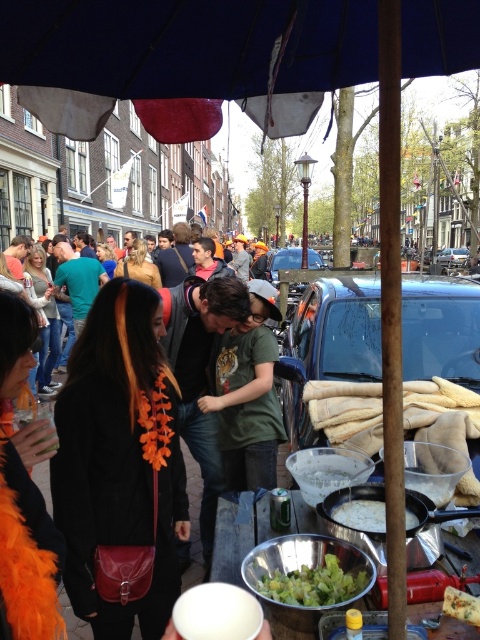
Between point (288, 596) and point (284, 259), which one is positioned in front?

Positioned in front is point (288, 596).

Can you confirm if green leafy salad at lower center is positioned to the left of metallic blue car at center?

Correct, you'll find green leafy salad at lower center to the left of metallic blue car at center.

Which is in front, point (349, 588) or point (276, 250)?

Point (349, 588) is in front.

You are a GUI agent. You are given a task and a screenshot of the screen. Output one action in this format:
    pyautogui.click(x=<x>, y=<y>)
    Task: Click on the green leafy salad at lower center
    The width and height of the screenshot is (480, 640).
    Given the screenshot: What is the action you would take?
    pyautogui.click(x=313, y=584)

Which is more to the right, white creamy soup at center or metallic blue car at center?

From the viewer's perspective, metallic blue car at center appears more on the right side.

Which is more to the left, white creamy soup at center or metallic blue car at center?

white creamy soup at center is more to the left.

Between point (406, 513) and point (291, 268), which one is positioned behind?

Positioned behind is point (291, 268).

At what (x,y) coordinates should I click in order to perform the action: click on white creamy soup at center. Please return your answer as a coordinate pair (x, y). Image resolution: width=480 pixels, height=640 pixels. Looking at the image, I should click on (360, 515).

Between blue matte car at center and metallic silver car at center, which one is positioned higher?

metallic silver car at center is above.

Does point (328, 365) come closer to viewer compared to point (453, 266)?

Yes, point (328, 365) is closer to viewer.

This screenshot has width=480, height=640. Find the location of `blue matte car at center`. blue matte car at center is located at coordinates (328, 344).